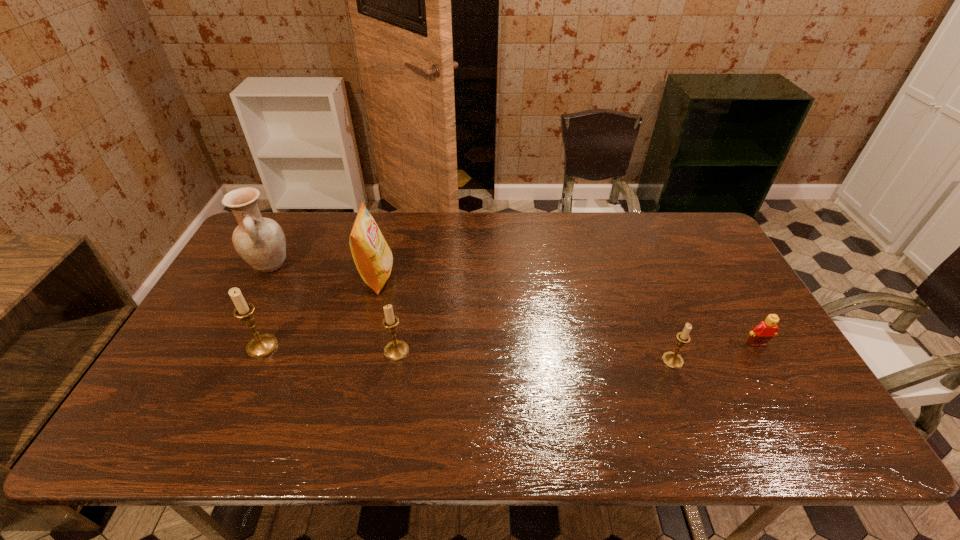
Find the location of `free space for an extra candle_holder to achieve even spacing`. free space for an extra candle_holder to achieve even spacing is located at coordinates (533, 356).